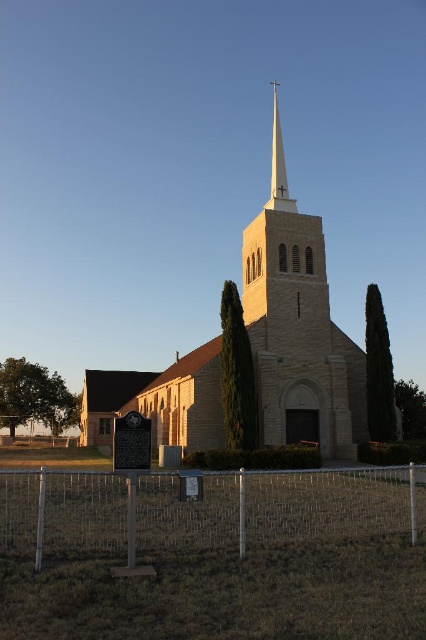
Who is positioned more to the right, green textured tree at right or green leafy tree at lower right?

green leafy tree at lower right is more to the right.

From the picture: Between green textured tree at right and green leafy tree at lower right, which one has more height?

green textured tree at right is taller.

Which is behind, point (382, 397) or point (417, 413)?

The point (417, 413) is behind.

Find the location of a particular element. green textured tree at right is located at coordinates (379, 371).

Does green textured tree at right appear under white smooth steeple at center?

Yes, green textured tree at right is below white smooth steeple at center.

Does green textured tree at right have a lesser height compared to white smooth steeple at center?

Indeed, green textured tree at right has a lesser height compared to white smooth steeple at center.

Find the location of a particular element. green textured tree at right is located at coordinates (379, 371).

Is metal chain-link fence at lower center closer to camera compared to white smooth steeple at center?

Yes, metal chain-link fence at lower center is in front of white smooth steeple at center.

Does metal chain-link fence at lower center have a lesser height compared to white smooth steeple at center?

Correct, metal chain-link fence at lower center is not as tall as white smooth steeple at center.

Locate an element on the screen. The height and width of the screenshot is (640, 426). metal chain-link fence at lower center is located at coordinates (204, 508).

Identify the location of metal chain-link fence at lower center. (204, 508).